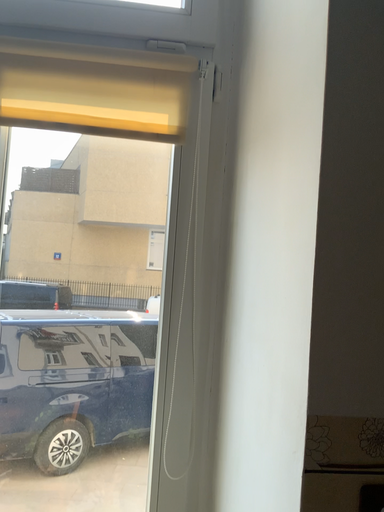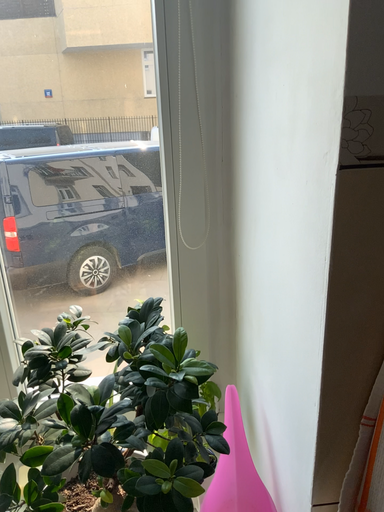
Question: Which way did the camera rotate in the video?

Choices:
 (A) rotated upward
 (B) rotated downward

Answer: (B)